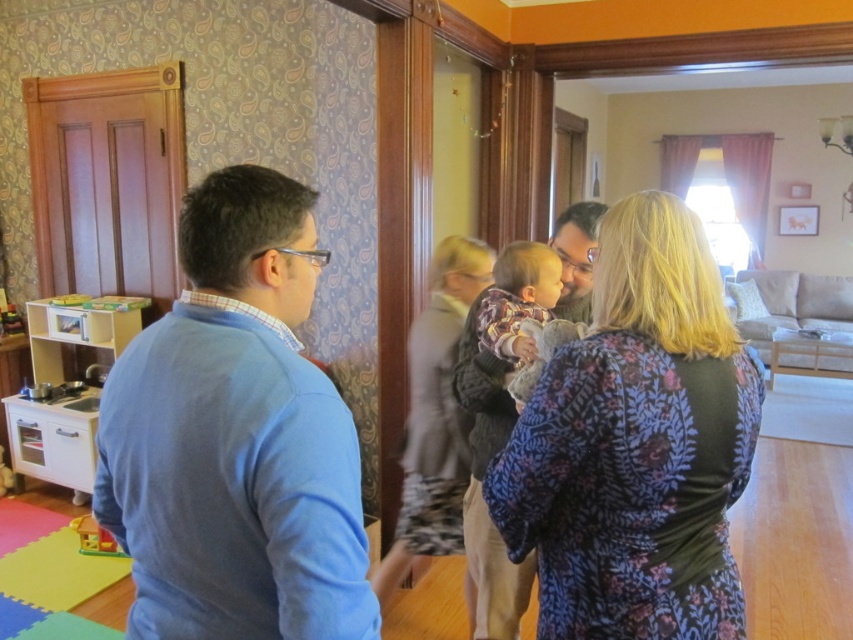
Question: Is floral fabric dress at center wider than plastic yellow house at lower left?

Choices:
 (A) no
 (B) yes

Answer: (B)

Question: Which of these objects is positioned closest to the plastic yellow house at lower left?

Choices:
 (A) blue cotton sweater at left
 (B) floral fabric dress at center
 (C) wooden toy kitchen at lower left
 (D) smooth beige shirt at center

Answer: (C)

Question: Which point is farther to the camera?

Choices:
 (A) (0, 477)
 (B) (654, 403)

Answer: (A)

Question: Which point is closer to the camera taking this photo?

Choices:
 (A) (103, 531)
 (B) (0, 470)

Answer: (A)

Question: Is floral fabric dress at center thinner than wooden toy kitchen at lower left?

Choices:
 (A) no
 (B) yes

Answer: (A)

Question: Is blue cotton sweater at left bigger than wooden toy kitchen at lower left?

Choices:
 (A) yes
 (B) no

Answer: (A)